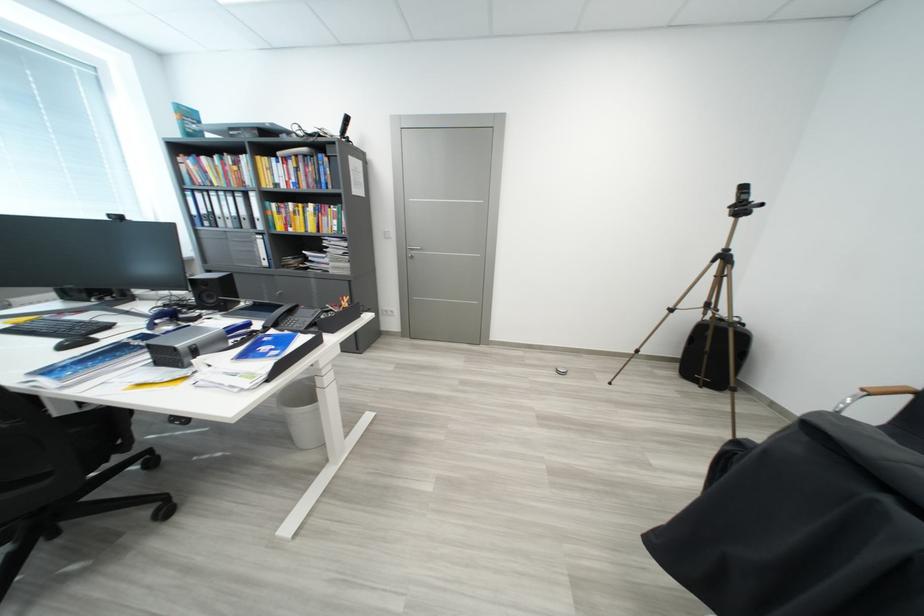
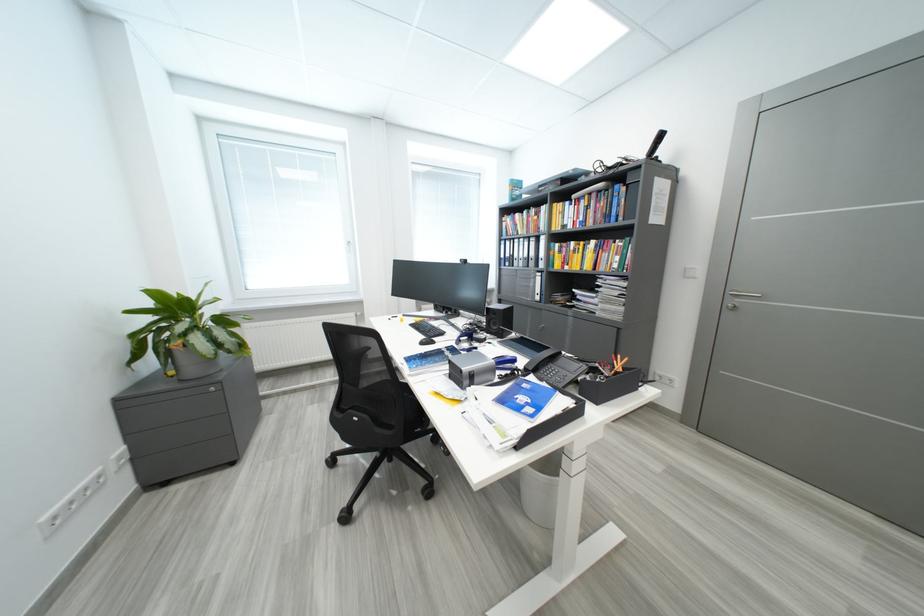
Find the pixel in the second image that matches [241,331] in the first image.

(511, 363)